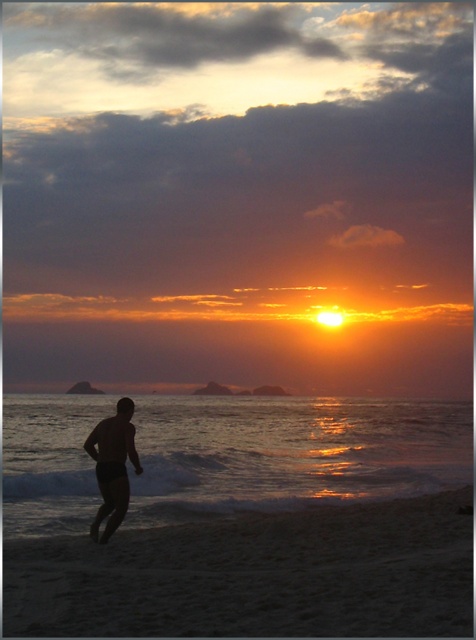
Question: Which object appears farthest from the camera in this image?

Choices:
 (A) black matte/silhouette man at lower left
 (B) sandy beach at lower center

Answer: (A)

Question: Is sandy beach at lower center wider than black matte/silhouette man at lower left?

Choices:
 (A) no
 (B) yes

Answer: (B)

Question: Observing the image, what is the correct spatial positioning of sandy beach at lower center in reference to black matte/silhouette man at lower left?

Choices:
 (A) below
 (B) above

Answer: (A)

Question: Can you confirm if sandy beach at lower center is positioned to the right of black matte/silhouette man at lower left?

Choices:
 (A) yes
 (B) no

Answer: (A)